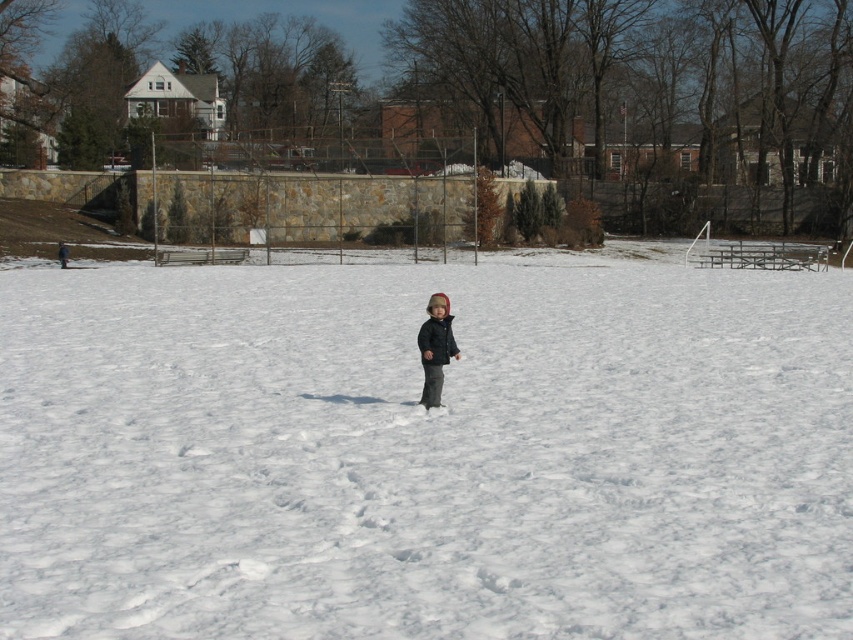
You are a photographer trying to capture the scene with the white fluffy snow at center and the dark blue matte jacket at center. Based on their positions, which object would appear larger in your photo?

The white fluffy snow at center appears larger in the photo because it is closer to the viewer than the dark blue matte jacket at center.

You are a photographer trying to capture the child in the snowy park. You notice the white fluffy snow at center and the dark gray fleece jacket at center. Which object is closer to the camera?

The white fluffy snow at center is closer to the camera than the dark gray fleece jacket at center because it is positioned in front of it.